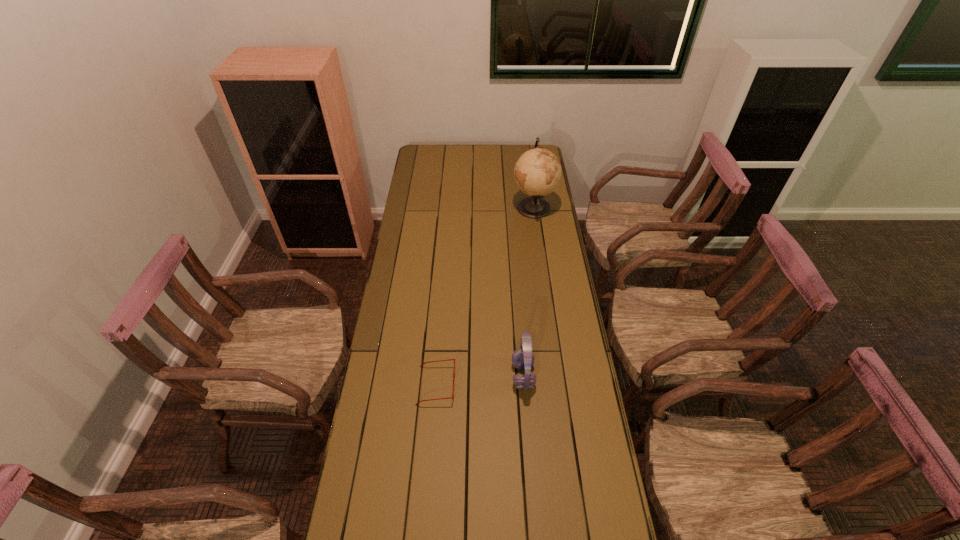
Where is `vacant space that is in between the leftmost object and the second tallest object`? vacant space that is in between the leftmost object and the second tallest object is located at coordinates (480, 380).

What are the coordinates of `the second closest object to the headset` in the screenshot? It's located at (537, 172).

This screenshot has height=540, width=960. Find the location of `object that is the closest to the globe`. object that is the closest to the globe is located at coordinates (523, 359).